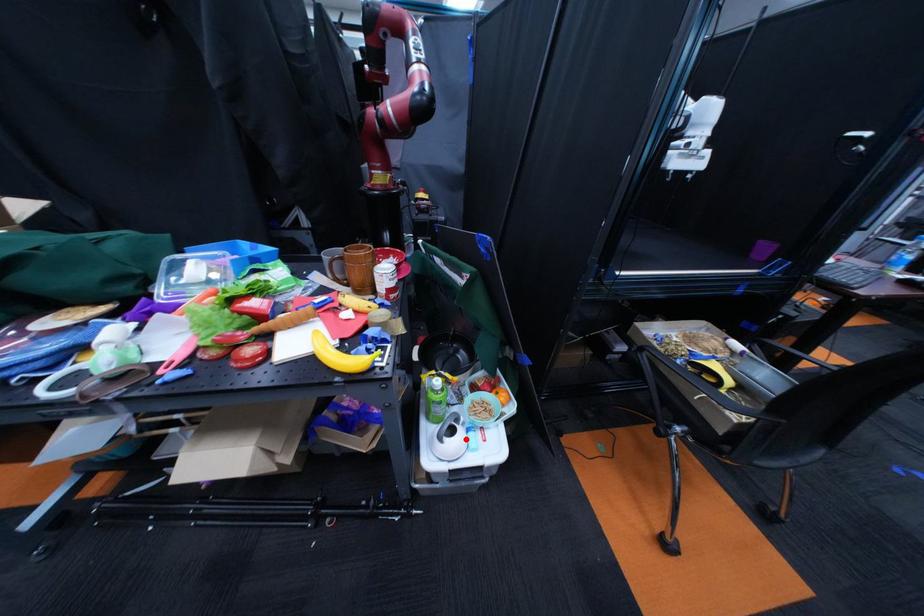
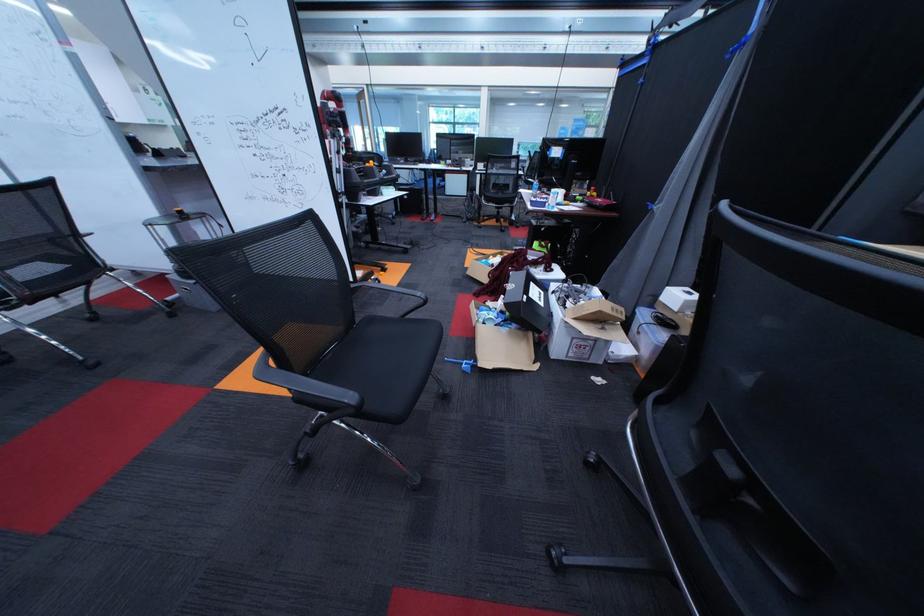
Question: I am providing you with two images of the same scene from different viewpoints. A red point is marked on the first image. Is the red point's position out of view in image 2?

Choices:
 (A) Yes
 (B) No

Answer: (A)